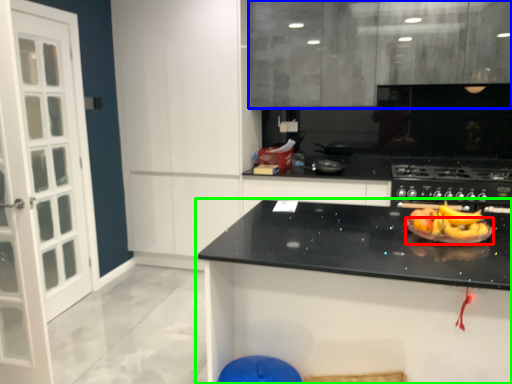
Question: Estimate the real-world distances between objects in this image. Which object is farther from paper plate (highlighted by a red box), cabinetry (highlighted by a blue box) or countertop (highlighted by a green box)?

Choices:
 (A) cabinetry
 (B) countertop

Answer: (A)